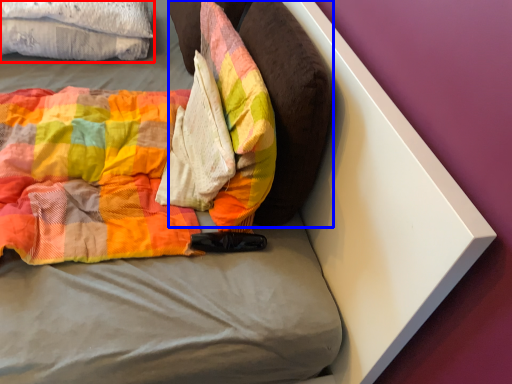
Question: Among these objects, which one is nearest to the camera, cloth (highlighted by a red box) or pillow (highlighted by a blue box)?

Choices:
 (A) cloth
 (B) pillow

Answer: (B)